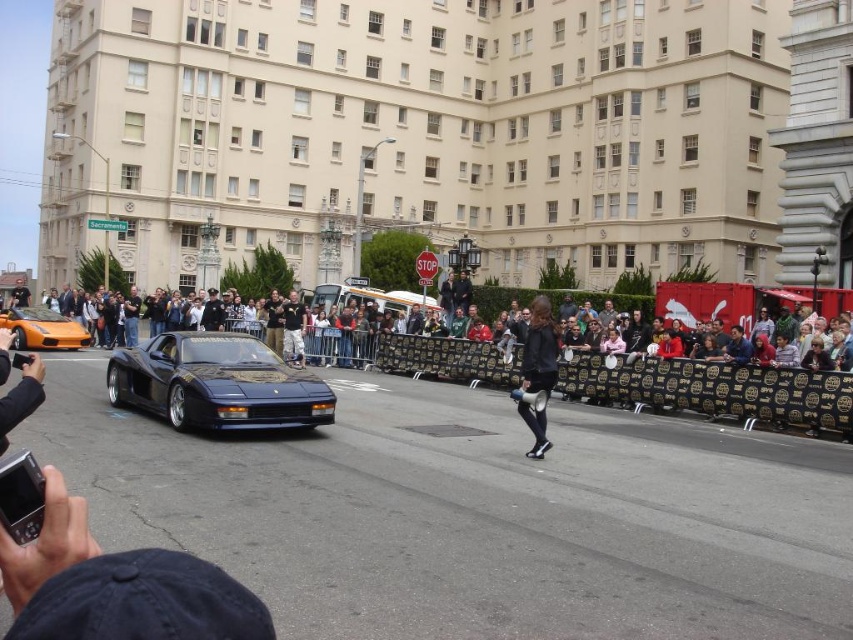
Is orange matte sports car at left in front of shiny silver van at center?

Yes, orange matte sports car at left is closer to the viewer.

Who is lower down, orange matte sports car at left or shiny silver van at center?

orange matte sports car at left is lower down.

Is point (68, 332) positioned after point (335, 304)?

That is False.

I want to click on orange matte sports car at left, so click(44, 330).

Can you confirm if shiny blue ferrari at center is wider than multicolored fabric crowd at center?

In fact, shiny blue ferrari at center might be narrower than multicolored fabric crowd at center.

Which is behind, point (252, 356) or point (695, 301)?

The point (695, 301) is behind.

Where is `shiny blue ferrari at center`? shiny blue ferrari at center is located at coordinates (216, 381).

Identify the location of shiny blue ferrari at center. The height and width of the screenshot is (640, 853). (216, 381).

Is shiny blue ferrari at center below orange matte sports car at left?

Yes.

Does point (318, 412) lie behind point (10, 324)?

That is False.

At what (x,y) coordinates should I click in order to perform the action: click on shiny blue ferrari at center. Please return your answer as a coordinate pair (x, y). Image resolution: width=853 pixels, height=640 pixels. Looking at the image, I should click on (216, 381).